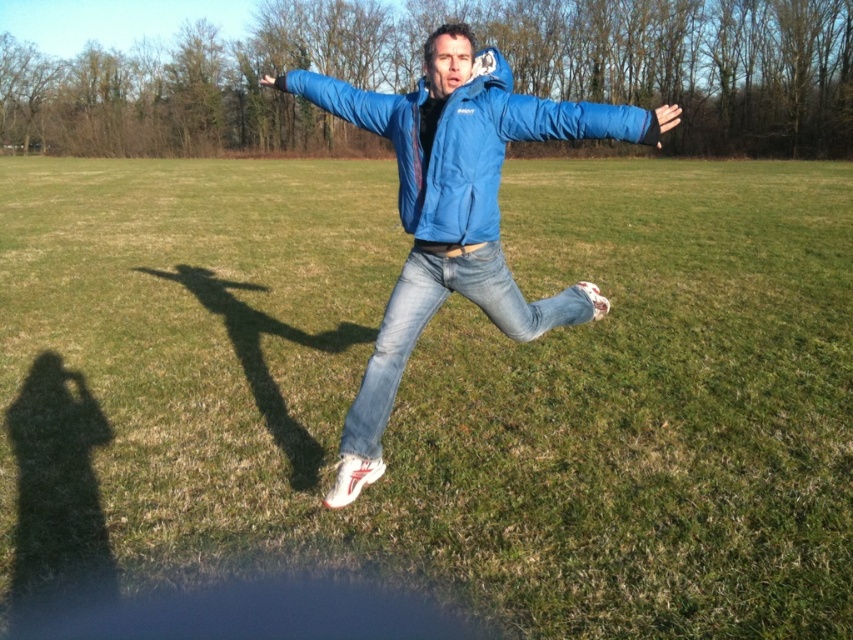
Question: Among these objects, which one is farthest from the camera?

Choices:
 (A) blue matte jacket at center
 (B) blue synthetic jacket at center
 (C) jeans at center

Answer: (C)

Question: Is blue matte jacket at center below blue synthetic jacket at center?

Choices:
 (A) no
 (B) yes

Answer: (B)

Question: Which object is positioned closest to the blue synthetic jacket at center?

Choices:
 (A) blue matte jacket at center
 (B) jeans at center

Answer: (B)

Question: Among these points, which one is nearest to the camera?

Choices:
 (A) (386, 380)
 (B) (329, 80)

Answer: (A)

Question: Does blue matte jacket at center have a lesser width compared to blue synthetic jacket at center?

Choices:
 (A) no
 (B) yes

Answer: (A)

Question: Is blue matte jacket at center wider than blue synthetic jacket at center?

Choices:
 (A) no
 (B) yes

Answer: (B)